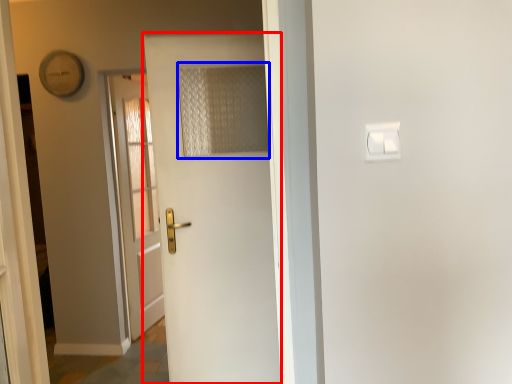
Question: Which point is closer to the camera, door (highlighted by a red box) or curtain (highlighted by a blue box)?

Choices:
 (A) door
 (B) curtain

Answer: (A)